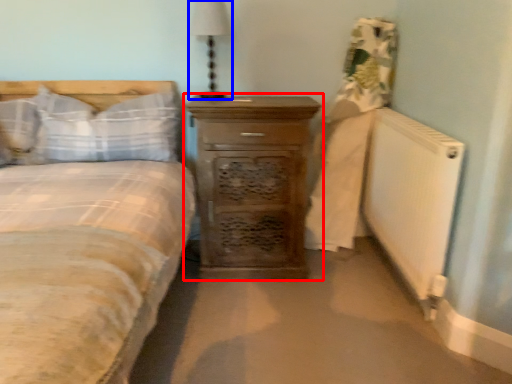
Question: Which of the following is the closest to the observer, chest of drawers (highlighted by a red box) or bedside lamp (highlighted by a blue box)?

Choices:
 (A) chest of drawers
 (B) bedside lamp

Answer: (A)